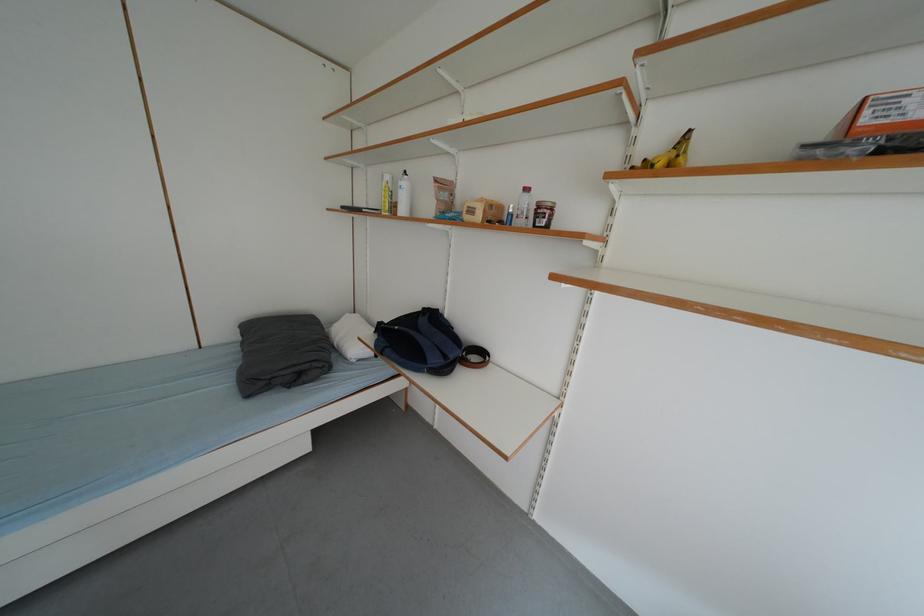
Find where to lift the cardboard box. Please return your answer as a coordinate pair (x, y).

(482, 211)